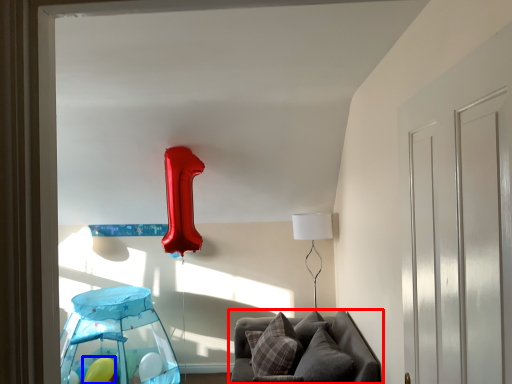
Question: Which point is closer to the camera, furniture (highlighted by a red box) or balloon (highlighted by a blue box)?

Choices:
 (A) furniture
 (B) balloon

Answer: (A)